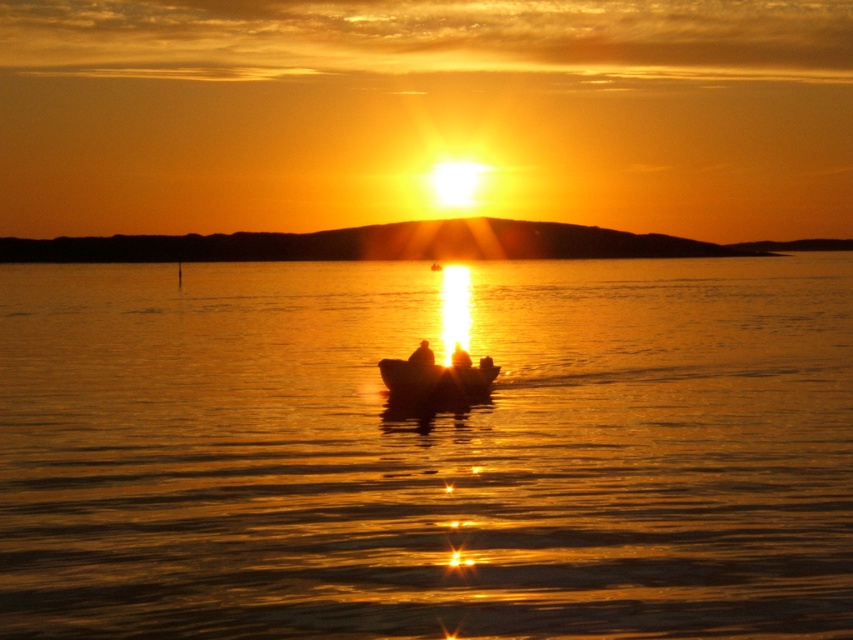
Question: Is glistening golden water at center above silhouette human at center?

Choices:
 (A) no
 (B) yes

Answer: (B)

Question: Does glistening golden water at center have a smaller size compared to smooth wooden boat at center?

Choices:
 (A) yes
 (B) no

Answer: (B)

Question: Which point appears farthest from the camera in this image?

Choices:
 (A) (457, 355)
 (B) (479, 388)

Answer: (B)

Question: Which of the following is the farthest from the observer?

Choices:
 (A) (456, 353)
 (B) (415, 355)
 (C) (418, 388)

Answer: (A)

Question: Observing the image, what is the correct spatial positioning of smooth wooden boat at center in reference to smooth skin figure at center?

Choices:
 (A) above
 (B) below

Answer: (B)

Question: Estimate the real-world distances between objects in this image. Which object is closer to the smooth skin figure at center?

Choices:
 (A) silhouette human at center
 (B) smooth wooden boat at center
 (C) glistening golden water at center

Answer: (B)